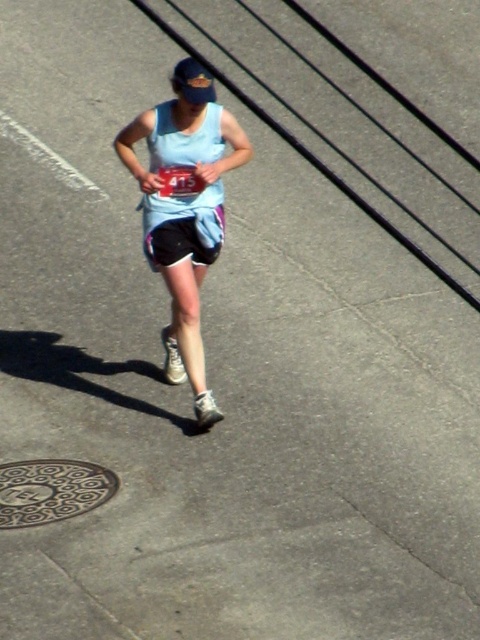
Question: Is brown textured manhole cover at lower left wider than light blue fabric shorts at center?

Choices:
 (A) yes
 (B) no

Answer: (A)

Question: Which of the following is the closest to the observer?

Choices:
 (A) light blue fabric shorts at center
 (B) light blue fabric runner at center
 (C) brown textured manhole cover at lower left

Answer: (C)

Question: Which object appears closest to the camera in this image?

Choices:
 (A) light blue fabric runner at center
 (B) light blue fabric shorts at center
 (C) brown textured manhole cover at lower left

Answer: (C)

Question: Can you confirm if light blue fabric runner at center is smaller than brown textured manhole cover at lower left?

Choices:
 (A) yes
 (B) no

Answer: (B)

Question: Which point appears farthest from the camera in this image?

Choices:
 (A) (13, 486)
 (B) (184, 244)
 (C) (210, 417)

Answer: (B)

Question: Can you confirm if brown textured manhole cover at lower left is positioned below light blue fabric shorts at center?

Choices:
 (A) yes
 (B) no

Answer: (A)